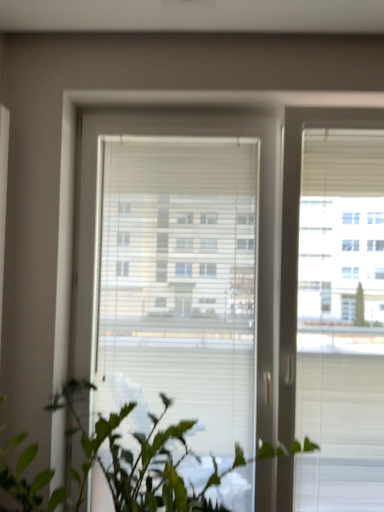
Question: From the image's perspective, relative to white plastic window at center, is green matte plant at lower left above or below?

Choices:
 (A) below
 (B) above

Answer: (A)

Question: Considering the positions of green matte plant at lower left and white plastic window at center in the image, is green matte plant at lower left wider or thinner than white plastic window at center?

Choices:
 (A) wide
 (B) thin

Answer: (A)

Question: From a real-world perspective, is green matte plant at lower left physically located above or below white plastic window at center?

Choices:
 (A) below
 (B) above

Answer: (A)

Question: From their relative heights in the image, would you say white plastic window at center is taller or shorter than green matte plant at lower left?

Choices:
 (A) tall
 (B) short

Answer: (A)

Question: Is white plastic window at center inside the boundaries of green matte plant at lower left, or outside?

Choices:
 (A) inside
 (B) outside

Answer: (B)

Question: Considering the relative positions of white plastic window at center and green matte plant at lower left in the image provided, is white plastic window at center to the left or to the right of green matte plant at lower left?

Choices:
 (A) left
 (B) right

Answer: (B)

Question: From the image's perspective, is white plastic window at center located above or below green matte plant at lower left?

Choices:
 (A) above
 (B) below

Answer: (A)